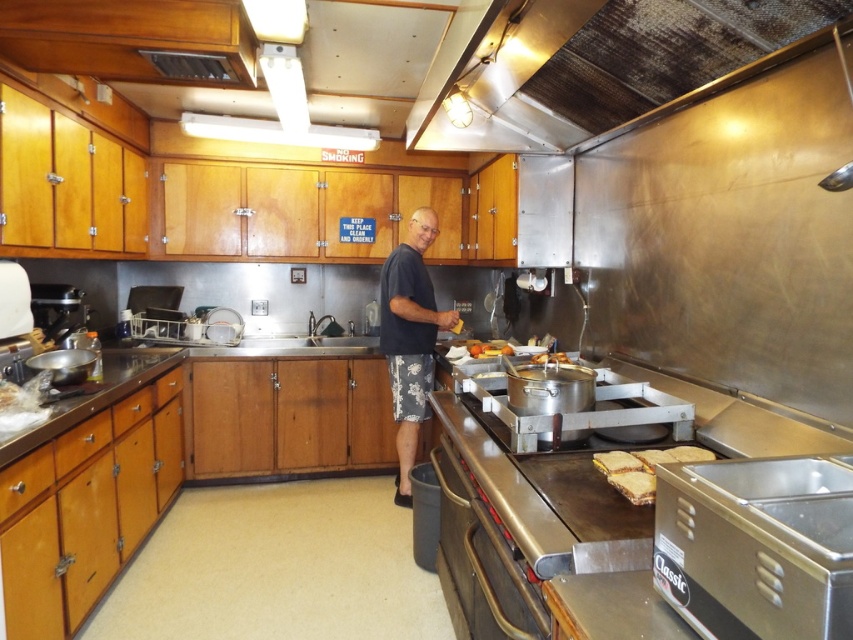
Where is `satin silver sink at center`? satin silver sink at center is located at coordinates 314,339.

Is point (318, 352) closer to camera compared to point (538, 355)?

No.

The width and height of the screenshot is (853, 640). I want to click on satin silver sink at center, so click(314, 339).

Between metallic at upper center and slightly toasted bread at center, which one has more height?

metallic at upper center is taller.

Where is `metallic at upper center`? This screenshot has height=640, width=853. metallic at upper center is located at coordinates (607, 64).

The width and height of the screenshot is (853, 640). Find the location of `metallic at upper center`. metallic at upper center is located at coordinates (607, 64).

This screenshot has height=640, width=853. What are the coordinates of `metallic at upper center` in the screenshot? It's located at (607, 64).

Does dark blue t-shirt at center have a smaller size compared to slightly toasted bread at center?

Incorrect, dark blue t-shirt at center is not smaller in size than slightly toasted bread at center.

Does dark blue t-shirt at center come in front of slightly toasted bread at center?

No, it is not.

The height and width of the screenshot is (640, 853). What do you see at coordinates (410, 337) in the screenshot?
I see `dark blue t-shirt at center` at bounding box center [410, 337].

This screenshot has height=640, width=853. Find the location of `dark blue t-shirt at center`. dark blue t-shirt at center is located at coordinates (410, 337).